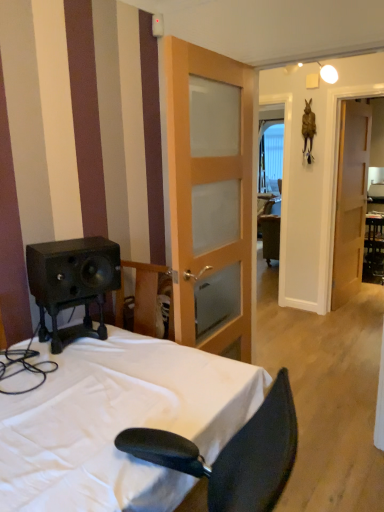
Question: Is white fabric bed at lower left oriented towards light brown wooden door at center, which is the first door from front to back?

Choices:
 (A) no
 (B) yes

Answer: (A)

Question: Is white fabric bed at lower left to the right of light brown wooden door at center, which is the second door from back to front, from the viewer's perspective?

Choices:
 (A) no
 (B) yes

Answer: (A)

Question: Considering the relative positions of white fabric bed at lower left and light brown wooden door at center, positioned as the second door in right-to-left order, in the image provided, is white fabric bed at lower left in front of light brown wooden door at center, positioned as the second door in right-to-left order,?

Choices:
 (A) yes
 (B) no

Answer: (A)

Question: Can you confirm if white fabric bed at lower left is bigger than light brown wooden door at center, which is the first door from front to back?

Choices:
 (A) no
 (B) yes

Answer: (A)

Question: From a real-world perspective, is white fabric bed at lower left beneath light brown wooden door at center, the first door from the left?

Choices:
 (A) yes
 (B) no

Answer: (A)

Question: Considering their positions, is clear glass window at center located in front of or behind black glossy table at right?

Choices:
 (A) front
 (B) behind

Answer: (B)

Question: From the image's perspective, is clear glass window at center located above or below black glossy table at right?

Choices:
 (A) above
 (B) below

Answer: (A)

Question: Do you think clear glass window at center is within black glossy table at right, or outside of it?

Choices:
 (A) inside
 (B) outside

Answer: (B)

Question: In the image, is clear glass window at center on the left side or the right side of black glossy table at right?

Choices:
 (A) left
 (B) right

Answer: (A)

Question: Considering their positions, is clear glass window at center located in front of or behind wooden door at right, which is the first door from back to front?

Choices:
 (A) behind
 (B) front

Answer: (A)

Question: From the image's perspective, relative to wooden door at right, placed as the 2th door when sorted from left to right, is clear glass window at center above or below?

Choices:
 (A) below
 (B) above

Answer: (B)

Question: Which is correct: clear glass window at center is inside wooden door at right, the 1th door in the right-to-left sequence, or outside of it?

Choices:
 (A) inside
 (B) outside

Answer: (B)

Question: Looking at the image, does clear glass window at center seem bigger or smaller compared to wooden door at right, the second door in the front-to-back sequence?

Choices:
 (A) big
 (B) small

Answer: (B)

Question: From the image's perspective, is wooden door at right, which is the first door from back to front, located above or below clear glass window at center?

Choices:
 (A) below
 (B) above

Answer: (A)

Question: Relative to clear glass window at center, is wooden door at right, the 1th door in the right-to-left sequence, in front or behind?

Choices:
 (A) behind
 (B) front

Answer: (B)